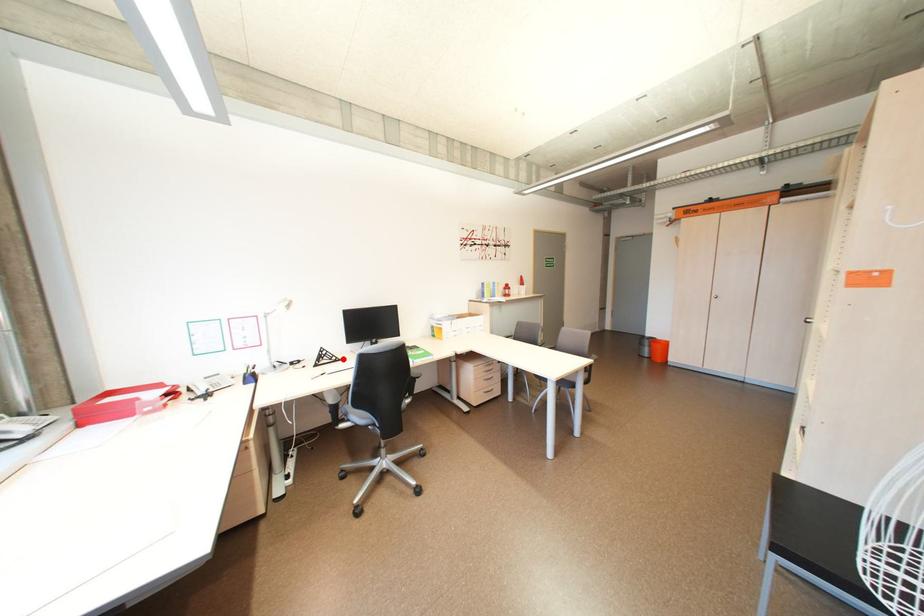
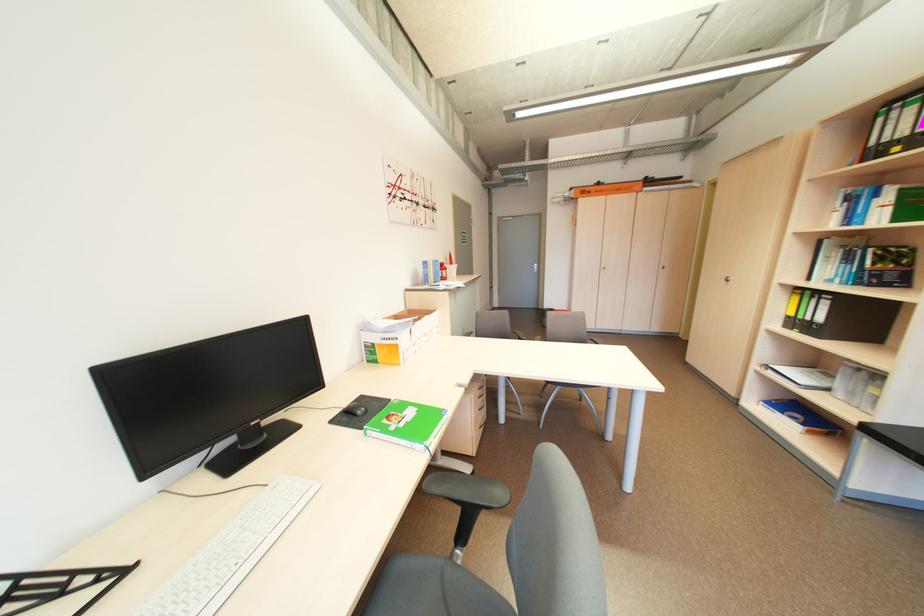
Question: I am providing you with two images of the same scene from different viewpoints. Image1 has a red point marked. In image2, the corresponding 3D location appears at what relative position? Reply with the corresponding letter.

Choices:
 (A) Closer
 (B) Farther

Answer: (A)